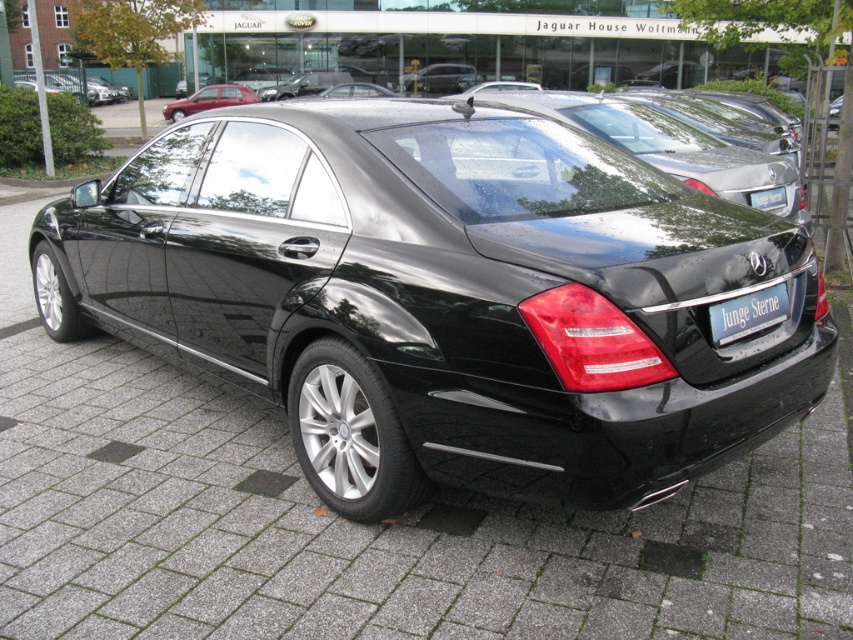
You are a photographer trying to capture both the black metallic car at center and the glossy black sedan at center in a single shot. Since you want to ensure both are clearly visible, which car should you focus on first to ensure the background remains sharp?

The black metallic car at center is in front of the glossy black sedan at center, so you should focus on the black metallic car at center first to ensure the background remains sharp.

You are a delivery person who needs to park a 12 feet long truck between the black metallic car at center and the glossy black sedan at center. Can you fit the truck in the space between them?

The black metallic car at center and glossy black sedan at center are 8.35 feet apart. Since the truck is 12 feet long, it cannot fit in the space between them as the distance is shorter than the truck.